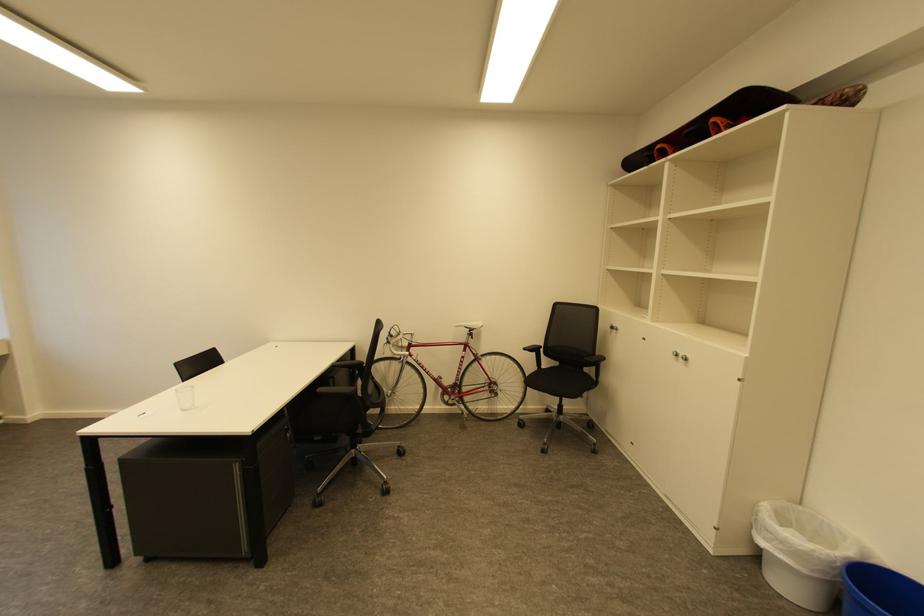
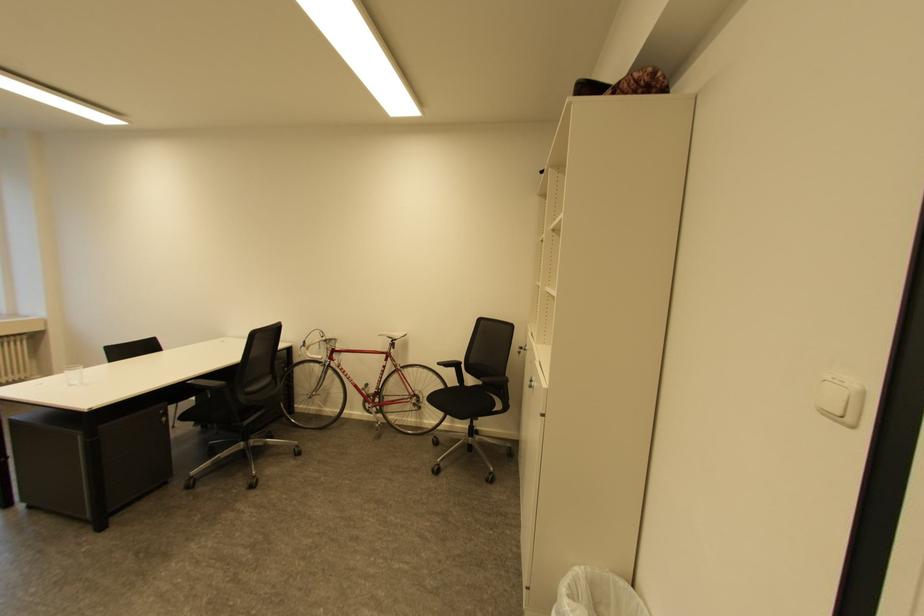
Where in the second image is the point corresponding to (x=477, y=329) from the first image?

(398, 339)